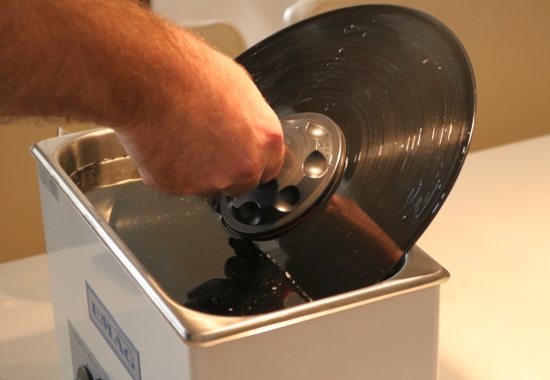
Locate an element on the screen. chair is located at coordinates (248, 18).